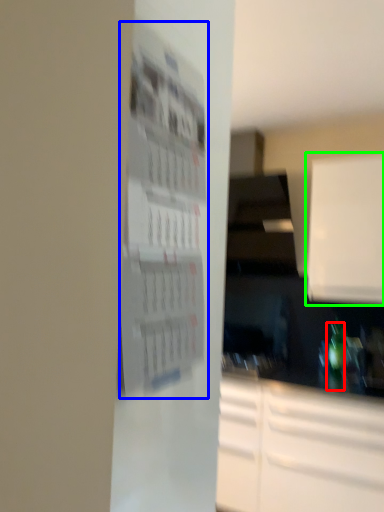
Question: Estimate the real-world distances between objects in this image. Which object is closer to bottle (highlighted by a red box), bulletin board (highlighted by a blue box) or cabinetry (highlighted by a green box)?

Choices:
 (A) bulletin board
 (B) cabinetry

Answer: (B)